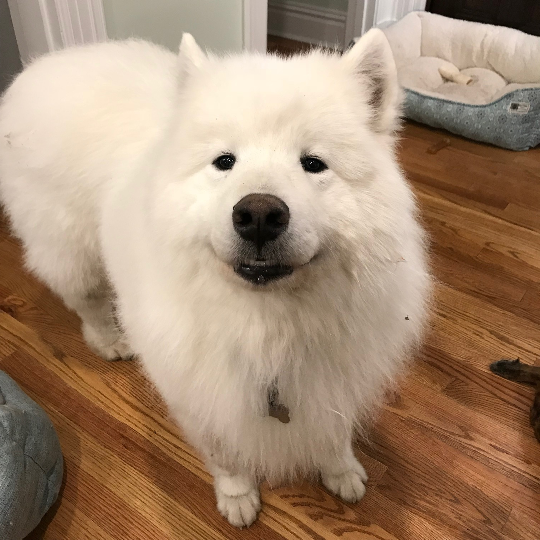
Locate an element on the screen. wood floor is located at coordinates (158, 468).